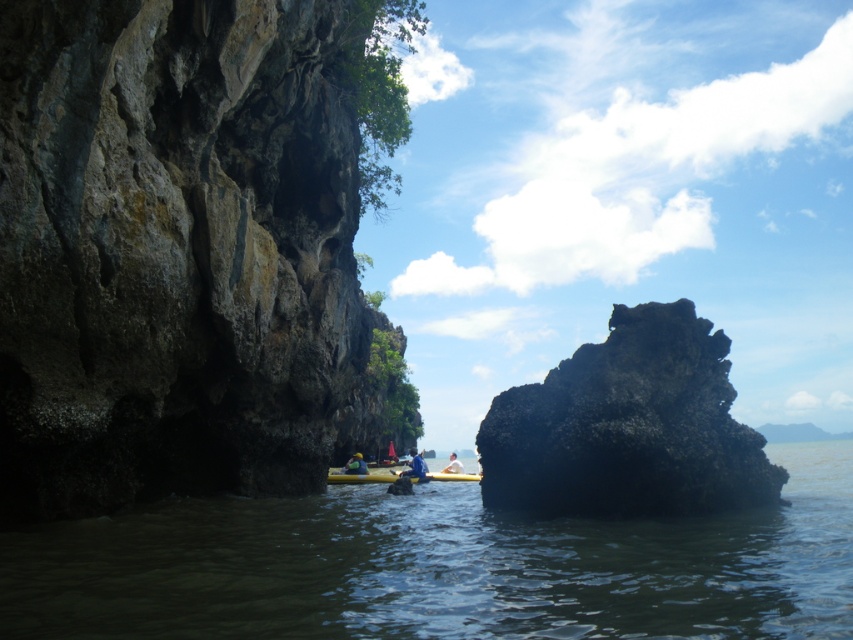
Does point (392, 476) come closer to viewer compared to point (413, 476)?

No, (392, 476) is behind (413, 476).

Where is `blue rubber boat at center`? The height and width of the screenshot is (640, 853). blue rubber boat at center is located at coordinates [363, 476].

Who is taller, rough stone cliff at left or black rough rock at center?

rough stone cliff at left

Who is more forward, (x=132, y=196) or (x=560, y=509)?

Point (x=132, y=196) is in front.

The width and height of the screenshot is (853, 640). What do you see at coordinates (177, 253) in the screenshot?
I see `rough stone cliff at left` at bounding box center [177, 253].

Find the location of `rough stone cliff at left`. rough stone cliff at left is located at coordinates (177, 253).

Image resolution: width=853 pixels, height=640 pixels. In order to click on blue fabric person at center in this screenshot , I will do `click(415, 467)`.